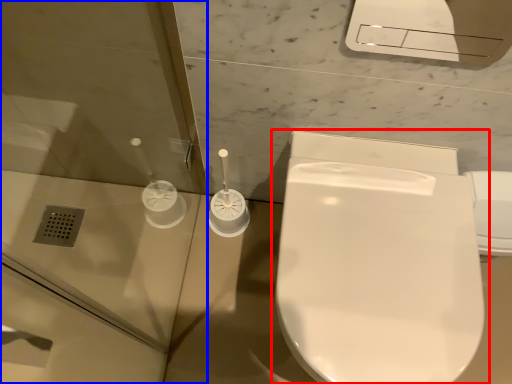
Question: Among these objects, which one is nearest to the camera, toilet (highlighted by a red box) or screen door (highlighted by a blue box)?

Choices:
 (A) toilet
 (B) screen door

Answer: (B)